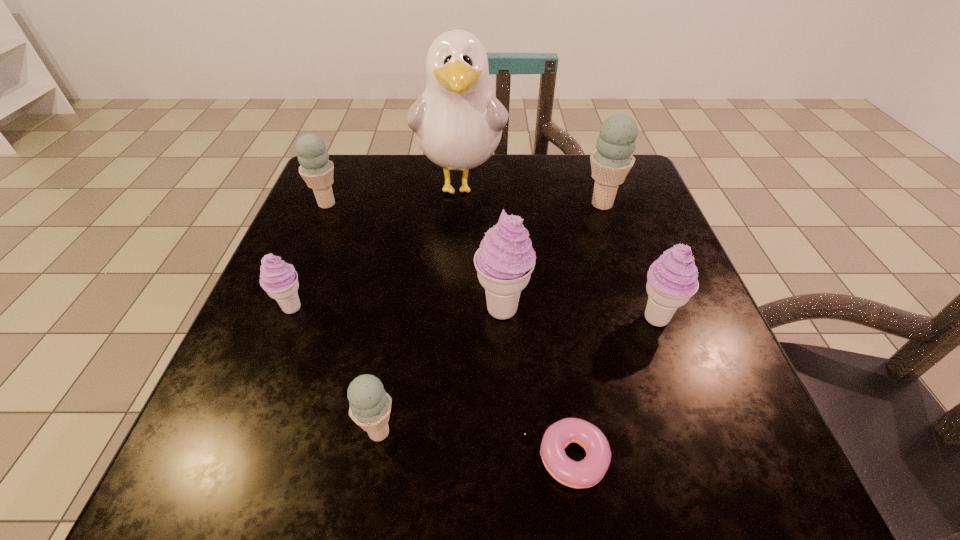
Image resolution: width=960 pixels, height=540 pixels. Identify the location of free space between the gull and the second smallest blue ice cream. (394, 194).

The height and width of the screenshot is (540, 960). I want to click on blank region between the second purple icecream from left to right and the rightmost blue ice cream, so click(552, 257).

This screenshot has width=960, height=540. I want to click on free spot between the second purple icecream from left to right and the shortest object, so click(x=535, y=383).

The height and width of the screenshot is (540, 960). Identify the location of empty space that is in between the fourth ice cream from left to right and the leftmost purple icecream. (396, 309).

At what (x,y) coordinates should I click in order to perform the action: click on empty space between the shortest object and the second smallest blue ice cream. Please return your answer as a coordinate pair (x, y). The image size is (960, 540). Looking at the image, I should click on (446, 331).

At what (x,y) coordinates should I click in order to perform the action: click on blank region between the purple doughnut and the leftmost purple icecream. Please return your answer as a coordinate pair (x, y). The height and width of the screenshot is (540, 960). Looking at the image, I should click on point(429,383).

Identify the location of blank region between the smallest purple icecream and the biggest blue ice cream. The height and width of the screenshot is (540, 960). (446, 256).

The height and width of the screenshot is (540, 960). In order to click on free area in between the fourth ice cream from left to right and the leftmost blue ice cream in this screenshot , I will do `click(415, 256)`.

The image size is (960, 540). In order to click on free point between the shortest object and the leftmost blue ice cream in this screenshot , I will do `click(446, 331)`.

In order to click on object that ranks as the second closest to the biggest blue ice cream in this screenshot , I will do `click(672, 279)`.